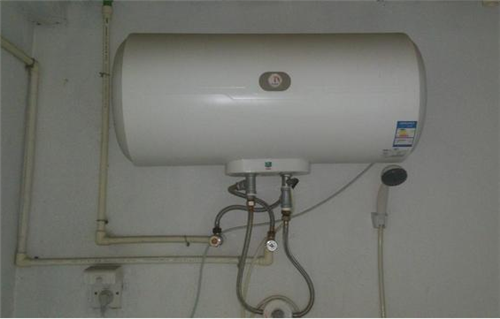
Locate an element on the screen. outlet is located at coordinates (101, 276).